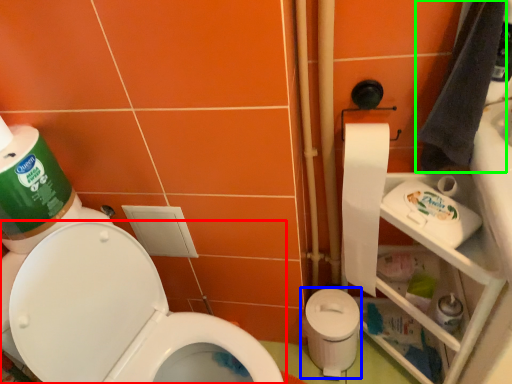
Question: Estimate the real-world distances between objects in this image. Which object is closer to toilet (highlighted by a red box), potty (highlighted by a blue box) or hand towel (highlighted by a green box)?

Choices:
 (A) potty
 (B) hand towel

Answer: (A)